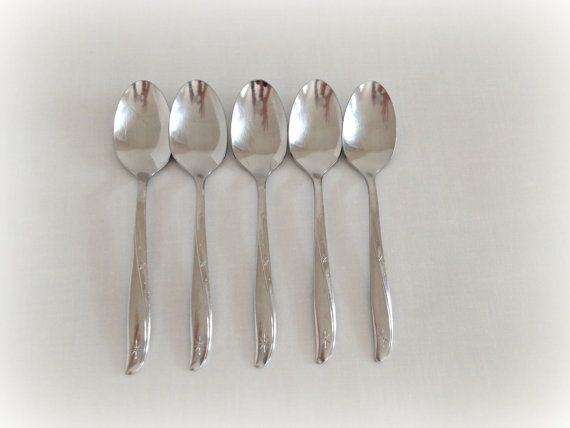
Locate an element on the screen. spoons is located at coordinates (149, 140), (194, 127), (275, 127), (337, 123), (364, 131).